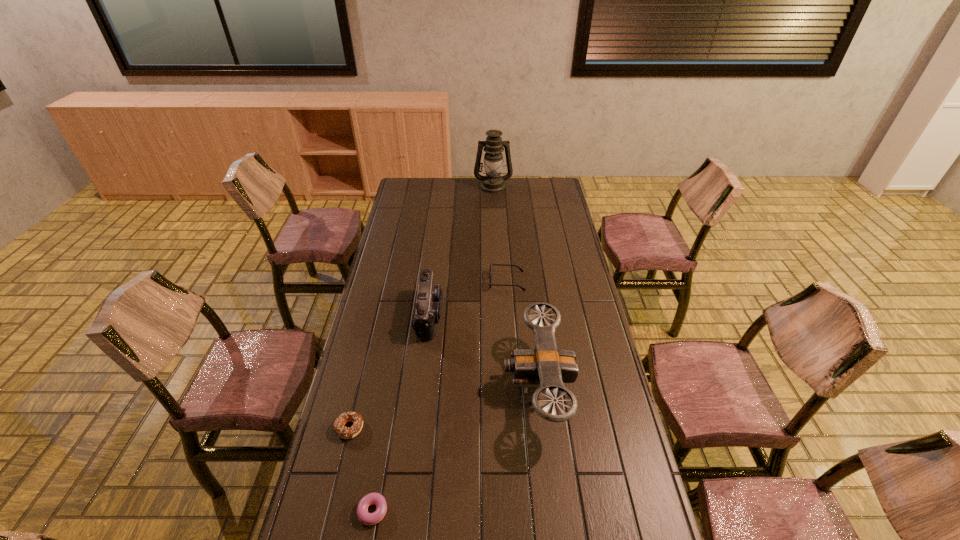
At what (x,y) coordinates should I click in order to perform the action: click on the farthest object. Please return your answer as a coordinate pair (x, y). Image resolution: width=960 pixels, height=540 pixels. Looking at the image, I should click on (493, 146).

Locate an element on the screen. Image resolution: width=960 pixels, height=540 pixels. oil lamp is located at coordinates (493, 146).

I want to click on the second tallest object, so click(x=545, y=365).

You are a GUI agent. You are given a task and a screenshot of the screen. Output one action in this format:
    pyautogui.click(x=<x>, y=<y>)
    Task: Click on the camcorder
    The height and width of the screenshot is (540, 960).
    Given the screenshot: What is the action you would take?
    pyautogui.click(x=429, y=299)

The image size is (960, 540). I want to click on the third shortest object, so click(520, 269).

Image resolution: width=960 pixels, height=540 pixels. I want to click on the fifth tallest object, so click(343, 432).

This screenshot has width=960, height=540. Find the location of `the leftmost object`. the leftmost object is located at coordinates (343, 432).

Image resolution: width=960 pixels, height=540 pixels. Find the location of `the nearer doughnut`. the nearer doughnut is located at coordinates (364, 516).

Where is `the right doughnut`? the right doughnut is located at coordinates (364, 516).

This screenshot has height=540, width=960. Find the location of `vacant area located 0.370m on the front of the oil lamp`. vacant area located 0.370m on the front of the oil lamp is located at coordinates (495, 232).